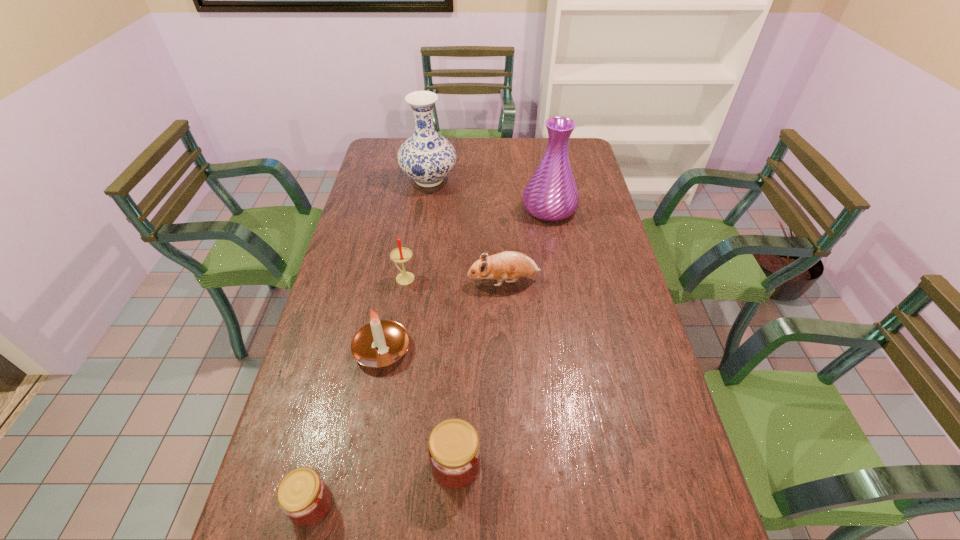
You are a GUI agent. You are given a task and a screenshot of the screen. Output one action in this format:
    pyautogui.click(x=<x>, y=<y>)
    Task: Click on the candle that is at the left edge
    
    Given the screenshot: What is the action you would take?
    pyautogui.click(x=380, y=343)

The width and height of the screenshot is (960, 540). I want to click on object located in the right edge section of the desktop, so click(x=551, y=194).

I want to click on object at the far left corner, so click(x=426, y=157).

This screenshot has height=540, width=960. What are the coordinates of `object situated at the near left corner` in the screenshot? It's located at (303, 496).

In the image, there is a desktop. Where is `vacant space at the far edge`? vacant space at the far edge is located at coordinates (496, 147).

Where is `free space at the near edge of the desktop`? free space at the near edge of the desktop is located at coordinates (446, 513).

Find the location of a particular element. The height and width of the screenshot is (540, 960). free space at the left edge is located at coordinates (357, 324).

In the image, there is a desktop. Identify the location of vacant region at the right edge. The image size is (960, 540). (635, 329).

Find the location of a particular element. The width and height of the screenshot is (960, 540). free space at the far left corner is located at coordinates (402, 137).

Where is `unoccupied position between the left jam and the hamster`? unoccupied position between the left jam and the hamster is located at coordinates (408, 393).